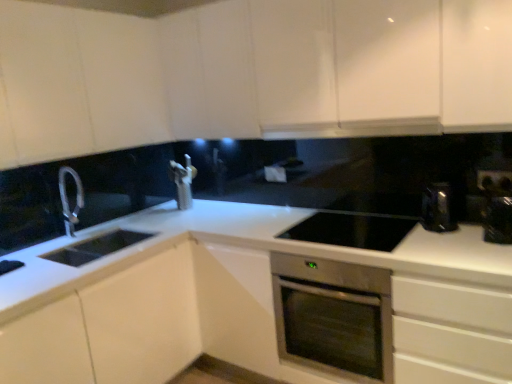
Question: Considering the relative sizes of white matte cabinet at left, the 3th cabinetry viewed from the top, and white glossy cabinet at upper left, arranged as the second cabinetry when ordered from the bottom, in the image provided, is white matte cabinet at left, the 3th cabinetry viewed from the top, bigger than white glossy cabinet at upper left, arranged as the second cabinetry when ordered from the bottom,?

Choices:
 (A) no
 (B) yes

Answer: (B)

Question: Could you tell me if white matte cabinet at left, the 3th cabinetry viewed from the top, is turned towards white glossy cabinet at upper left, the 2th cabinetry in the top-to-bottom sequence?

Choices:
 (A) no
 (B) yes

Answer: (A)

Question: From a real-world perspective, does white matte cabinet at left, the 3th cabinetry viewed from the top, sit lower than white glossy cabinet at upper left, the 2th cabinetry in the top-to-bottom sequence?

Choices:
 (A) no
 (B) yes

Answer: (B)

Question: Can you confirm if white matte cabinet at left, the 3th cabinetry viewed from the top, is smaller than white glossy cabinet at upper left, arranged as the second cabinetry when ordered from the bottom?

Choices:
 (A) yes
 (B) no

Answer: (B)

Question: From the image's perspective, is white matte cabinet at left, acting as the 1th cabinetry starting from the bottom, on top of white glossy cabinet at upper left, the 2th cabinetry in the top-to-bottom sequence?

Choices:
 (A) yes
 (B) no

Answer: (B)

Question: Considering the relative sizes of white matte cabinet at left, acting as the 1th cabinetry starting from the bottom, and white glossy cabinet at upper left, arranged as the second cabinetry when ordered from the bottom, in the image provided, is white matte cabinet at left, acting as the 1th cabinetry starting from the bottom, shorter than white glossy cabinet at upper left, arranged as the second cabinetry when ordered from the bottom,?

Choices:
 (A) yes
 (B) no

Answer: (B)

Question: Does black glass cooktop at center, which is the second appliance in right-to-left order, have a greater width compared to black plastic electric outlet at upper right?

Choices:
 (A) yes
 (B) no

Answer: (A)

Question: Is black glass cooktop at center, positioned as the 1th appliance in left-to-right order, taller than black plastic electric outlet at upper right?

Choices:
 (A) yes
 (B) no

Answer: (B)

Question: From a real-world perspective, does black glass cooktop at center, which is the second appliance in right-to-left order, sit lower than black plastic electric outlet at upper right?

Choices:
 (A) yes
 (B) no

Answer: (A)

Question: Is black glass cooktop at center, positioned as the 1th appliance in left-to-right order, in front of black plastic electric outlet at upper right?

Choices:
 (A) yes
 (B) no

Answer: (A)

Question: Is black glass cooktop at center, positioned as the 1th appliance in left-to-right order, located outside black plastic electric outlet at upper right?

Choices:
 (A) yes
 (B) no

Answer: (A)

Question: Is black glass cooktop at center, which is the second appliance in right-to-left order, facing away from black plastic electric outlet at upper right?

Choices:
 (A) no
 (B) yes

Answer: (A)

Question: From the image's perspective, would you say stainless steel oven at center is positioned over white glossy cabinet at upper left, arranged as the second cabinetry when ordered from the bottom?

Choices:
 (A) yes
 (B) no

Answer: (B)